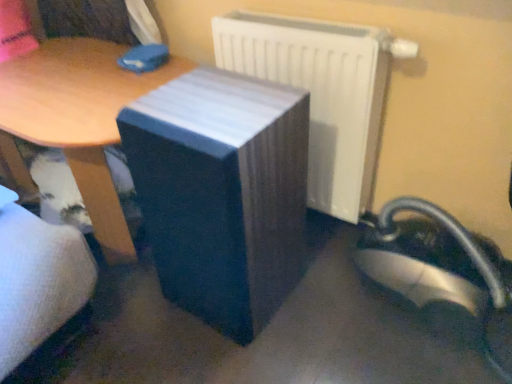
What are the coordinates of `vacant space in white glossy radiator at upper right (from a real-world perspective)` in the screenshot? It's located at (332, 228).